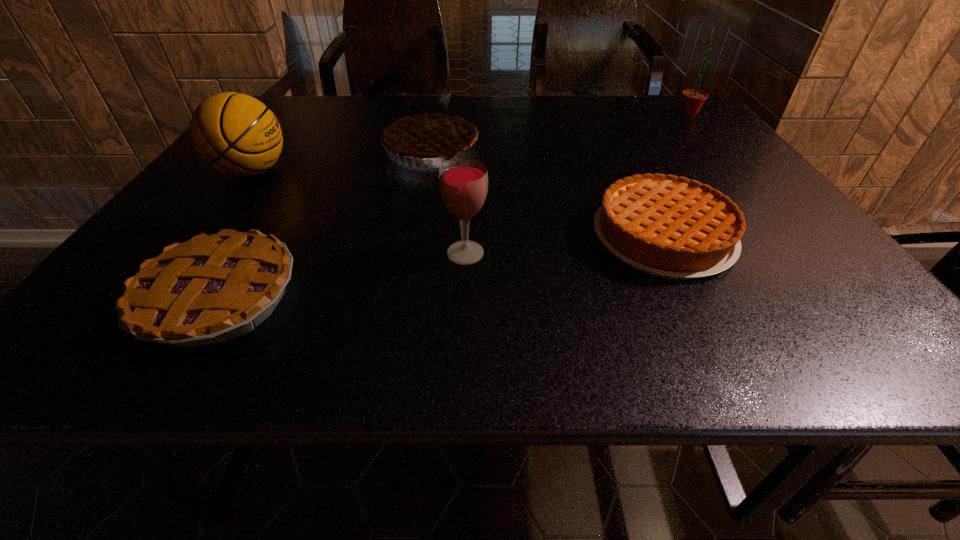
What are the coordinates of `free region located 0.350m on the face of the sunflower` in the screenshot? It's located at [x=559, y=114].

This screenshot has width=960, height=540. What are the coordinates of `free space located 0.170m on the back of the farthest pie` in the screenshot? It's located at (439, 103).

Identify the location of free space located on the surface of the basketball near the brand logo. (320, 172).

Find the location of a particular element. Image resolution: width=960 pixels, height=540 pixels. vacant space located 0.060m on the left of the wineglass is located at coordinates (413, 253).

Find the location of a particular element. This screenshot has height=540, width=960. vacant space located 0.280m on the back of the fifth object from left to right is located at coordinates (616, 140).

Locate an element on the screen. free location located 0.240m on the back of the leftmost pie is located at coordinates (288, 183).

Identify the location of sunflower that is at the far edge. Image resolution: width=960 pixels, height=540 pixels. (692, 100).

Find the location of a particular element. pie present at the far edge is located at coordinates (431, 131).

I want to click on object present at the near edge, so click(213, 288).

Find the location of a particular element. Image resolution: width=960 pixels, height=540 pixels. basketball that is at the left edge is located at coordinates (236, 134).